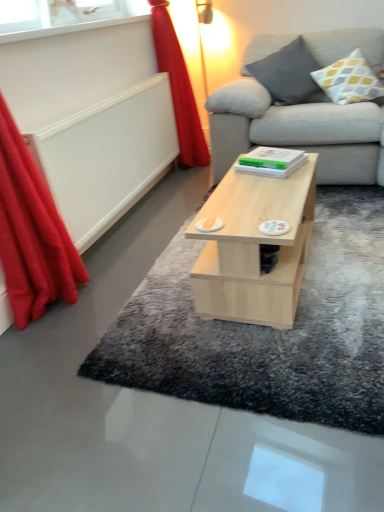
Question: Is red velvet curtain at left, which is the 1th curtain from back to front, directly adjacent to red fabric curtain at left, which is the 1th curtain from front to back?

Choices:
 (A) no
 (B) yes

Answer: (A)

Question: From a real-world perspective, does red velvet curtain at left, which ranks as the 1th curtain in right-to-left order, sit lower than red fabric curtain at left, which ranks as the 2th curtain in right-to-left order?

Choices:
 (A) no
 (B) yes

Answer: (B)

Question: Is red velvet curtain at left, which ranks as the 2th curtain in left-to-right order, oriented away from red fabric curtain at left, which ranks as the second curtain in back-to-front order?

Choices:
 (A) no
 (B) yes

Answer: (A)

Question: Does red velvet curtain at left, which ranks as the 1th curtain in right-to-left order, turn towards red fabric curtain at left, which ranks as the 2th curtain in right-to-left order?

Choices:
 (A) no
 (B) yes

Answer: (A)

Question: Are red velvet curtain at left, which is counted as the second curtain, starting from the front, and red fabric curtain at left, which is the 1th curtain from front to back, far apart?

Choices:
 (A) no
 (B) yes

Answer: (B)

Question: From the image's perspective, relative to red velvet curtain at left, which ranks as the 2th curtain in left-to-right order, is yellow and gray dotted pillow at upper right, acting as the 1th pillow starting from the right, above or below?

Choices:
 (A) below
 (B) above

Answer: (B)

Question: Is yellow and gray dotted pillow at upper right, placed as the second pillow when sorted from left to right, bigger or smaller than red velvet curtain at left, which is counted as the second curtain, starting from the front?

Choices:
 (A) big
 (B) small

Answer: (B)

Question: Is yellow and gray dotted pillow at upper right, acting as the 1th pillow starting from the right, situated inside red velvet curtain at left, which is the 1th curtain from back to front, or outside?

Choices:
 (A) outside
 (B) inside

Answer: (A)

Question: Is point (332, 84) closer or farther from the camera than point (185, 143)?

Choices:
 (A) closer
 (B) farther

Answer: (A)

Question: Would you say red velvet curtain at left, which is the 1th curtain from back to front, is inside or outside transparent glass window at upper left?

Choices:
 (A) outside
 (B) inside

Answer: (A)

Question: From the image's perspective, is red velvet curtain at left, which ranks as the 2th curtain in left-to-right order, positioned above or below transparent glass window at upper left?

Choices:
 (A) above
 (B) below

Answer: (B)

Question: Visually, is red velvet curtain at left, which is counted as the second curtain, starting from the front, positioned to the left or to the right of transparent glass window at upper left?

Choices:
 (A) left
 (B) right

Answer: (B)

Question: In terms of size, does red velvet curtain at left, which is the 1th curtain from back to front, appear bigger or smaller than transparent glass window at upper left?

Choices:
 (A) small
 (B) big

Answer: (B)

Question: Is light gray shaggy rug at center inside or outside of light wood coffee table at center?

Choices:
 (A) outside
 (B) inside

Answer: (A)

Question: Considering the relative positions of light gray shaggy rug at center and light wood coffee table at center in the image provided, is light gray shaggy rug at center to the left or to the right of light wood coffee table at center?

Choices:
 (A) right
 (B) left

Answer: (A)